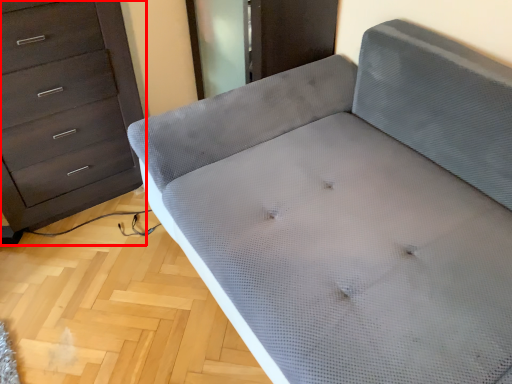
Question: From the image's perspective, what is the correct spatial relationship of chest of drawers (annotated by the red box) in relation to furniture?

Choices:
 (A) below
 (B) above

Answer: (B)